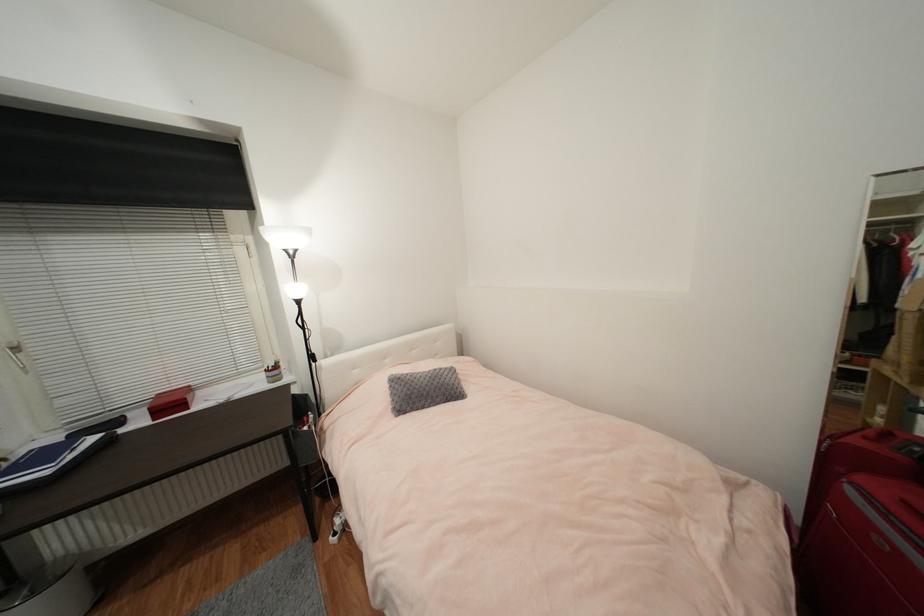
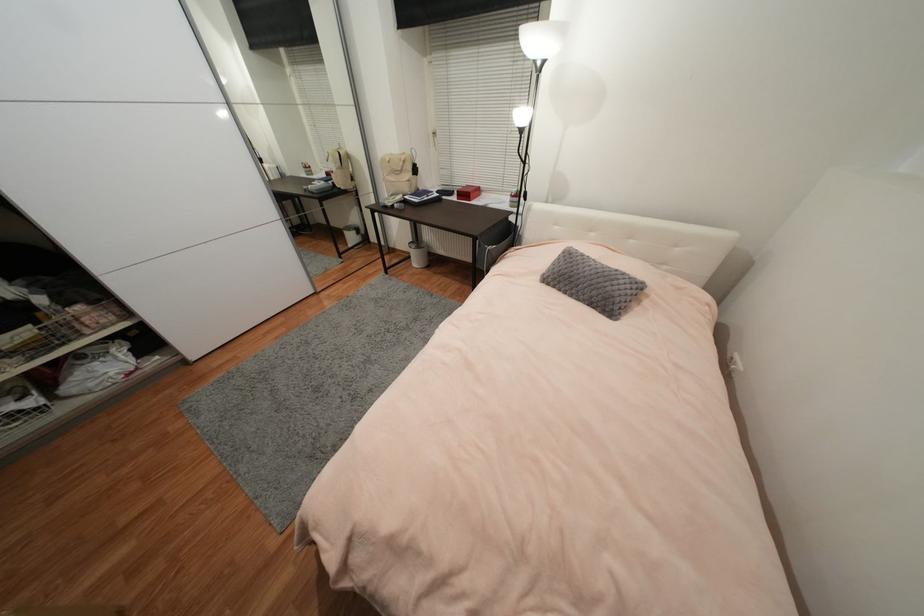
In the second image, find the point that corresponds to pixel 428 408 in the first image.

(569, 294)